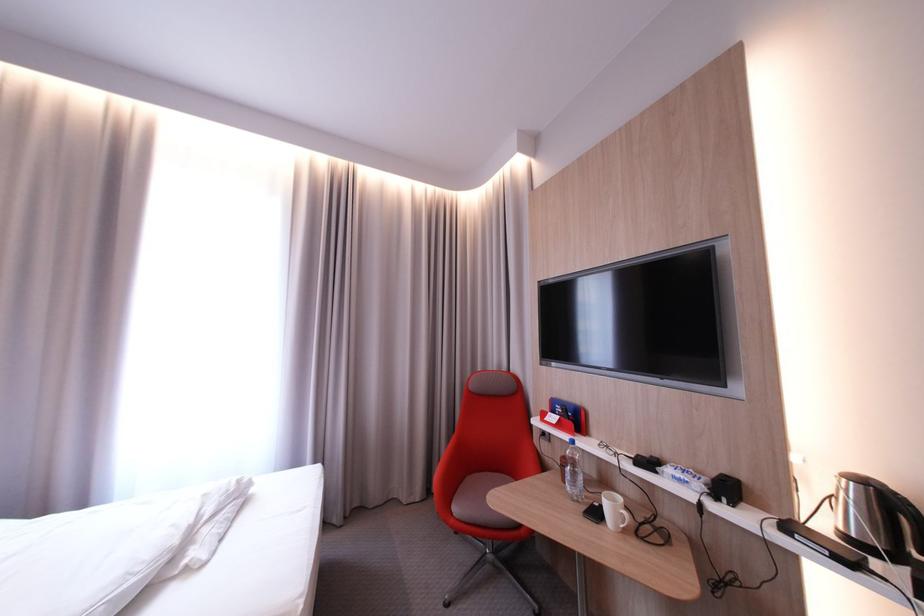
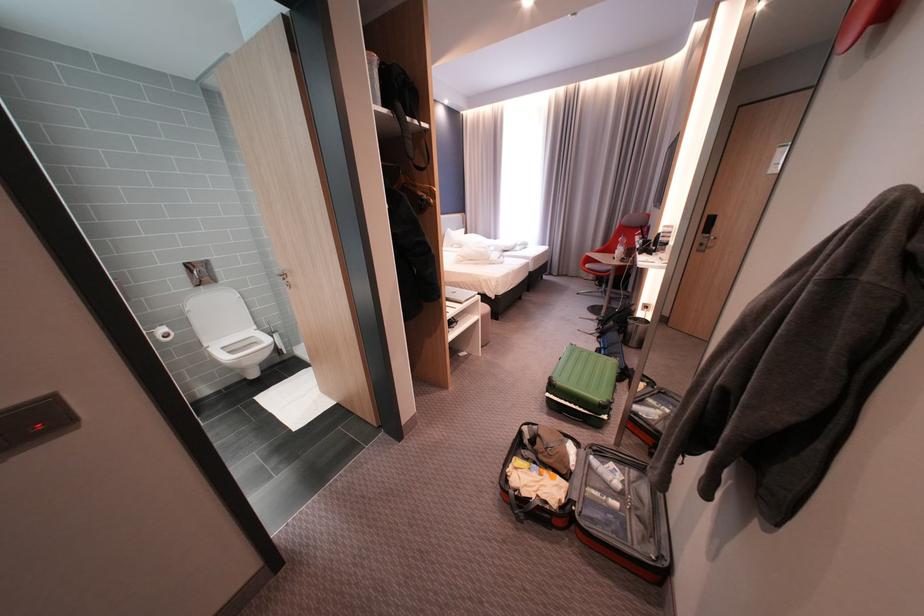
Where in the second image is the point corresponding to pixel 467 511 from the first image?

(598, 265)